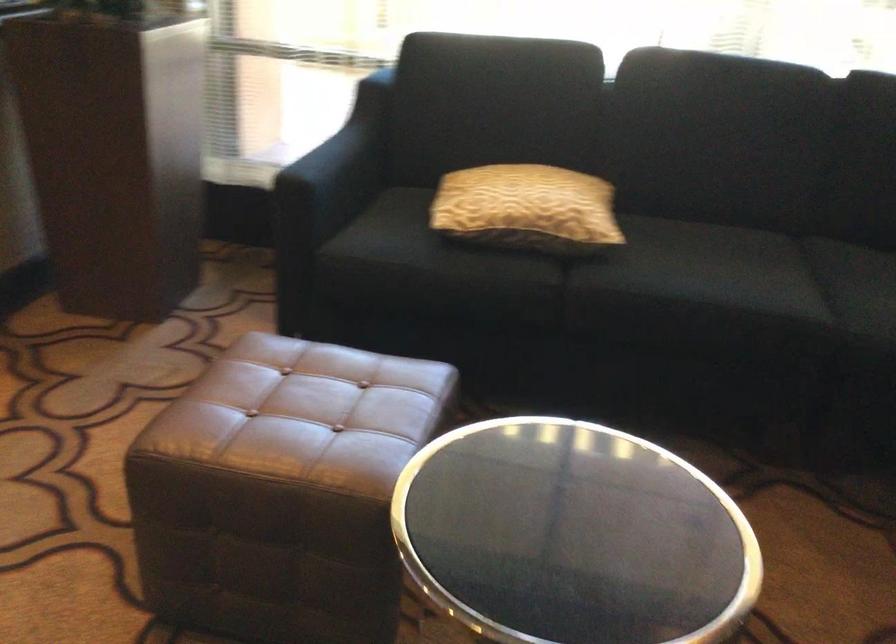
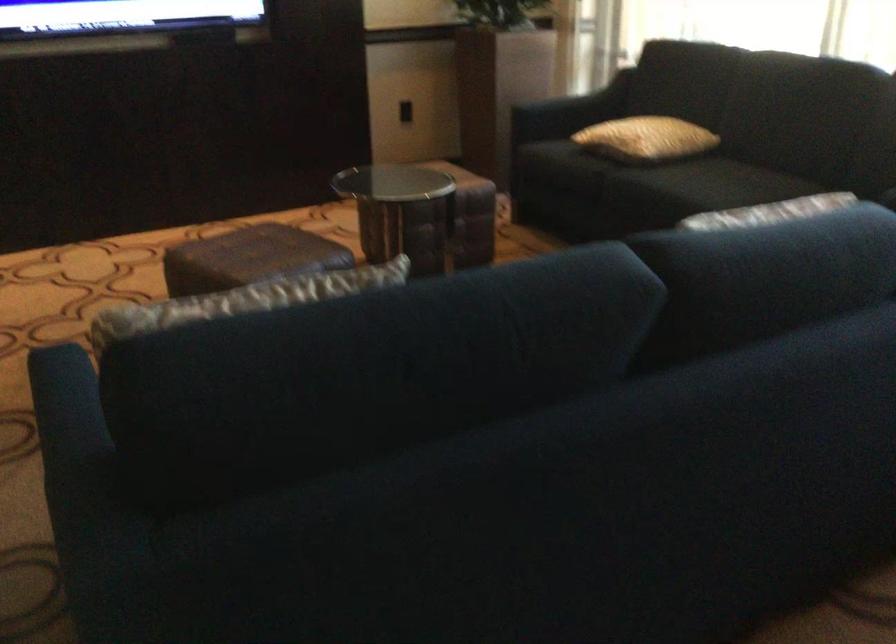
Find the pixel in the second image that matches (x=741, y=278) in the first image.

(709, 184)